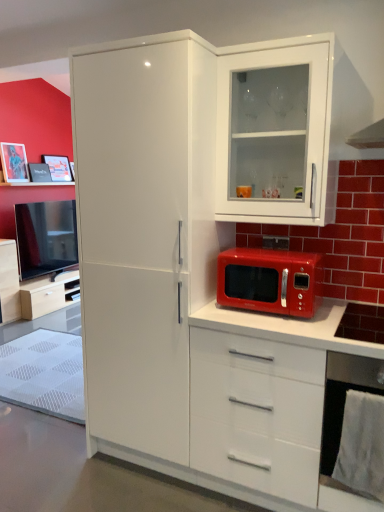
Question: Considering the relative sizes of matte white cabinet at left, the 1th cabinetry positioned from the left, and white glossy refrigerator at center in the image provided, is matte white cabinet at left, the 1th cabinetry positioned from the left, wider than white glossy refrigerator at center?

Choices:
 (A) yes
 (B) no

Answer: (B)

Question: Can you confirm if matte white cabinet at left, which ranks as the 1th cabinetry in back-to-front order, is taller than white glossy refrigerator at center?

Choices:
 (A) yes
 (B) no

Answer: (B)

Question: From the image's perspective, is matte white cabinet at left, which ranks as the 1th cabinetry in back-to-front order, under white glossy refrigerator at center?

Choices:
 (A) no
 (B) yes

Answer: (B)

Question: From a real-world perspective, is matte white cabinet at left, marked as the 2th cabinetry in a front-to-back arrangement, physically above white glossy refrigerator at center?

Choices:
 (A) no
 (B) yes

Answer: (A)

Question: Can we say matte white cabinet at left, marked as the 2th cabinetry in a front-to-back arrangement, lies outside white glossy refrigerator at center?

Choices:
 (A) no
 (B) yes

Answer: (B)

Question: Is matte white cabinet at left, which ranks as the 1th cabinetry in back-to-front order, at the left side of white glossy refrigerator at center?

Choices:
 (A) no
 (B) yes

Answer: (B)

Question: Is matte black phone at center not inside shiny red microwave at center?

Choices:
 (A) yes
 (B) no

Answer: (A)

Question: Does matte black phone at center turn towards shiny red microwave at center?

Choices:
 (A) yes
 (B) no

Answer: (A)

Question: Is shiny red microwave at center at the back of matte black phone at center?

Choices:
 (A) no
 (B) yes

Answer: (A)

Question: Considering the relative positions of matte black phone at center and shiny red microwave at center in the image provided, is matte black phone at center in front of shiny red microwave at center?

Choices:
 (A) yes
 (B) no

Answer: (B)

Question: Considering the relative positions of matte black phone at center and shiny red microwave at center in the image provided, is matte black phone at center behind shiny red microwave at center?

Choices:
 (A) yes
 (B) no

Answer: (A)

Question: Is matte black phone at center at the left side of shiny red microwave at center?

Choices:
 (A) yes
 (B) no

Answer: (B)

Question: Is matte white cabinet at left, marked as the 2th cabinetry in a front-to-back arrangement, smaller than shiny red microwave at center?

Choices:
 (A) yes
 (B) no

Answer: (B)